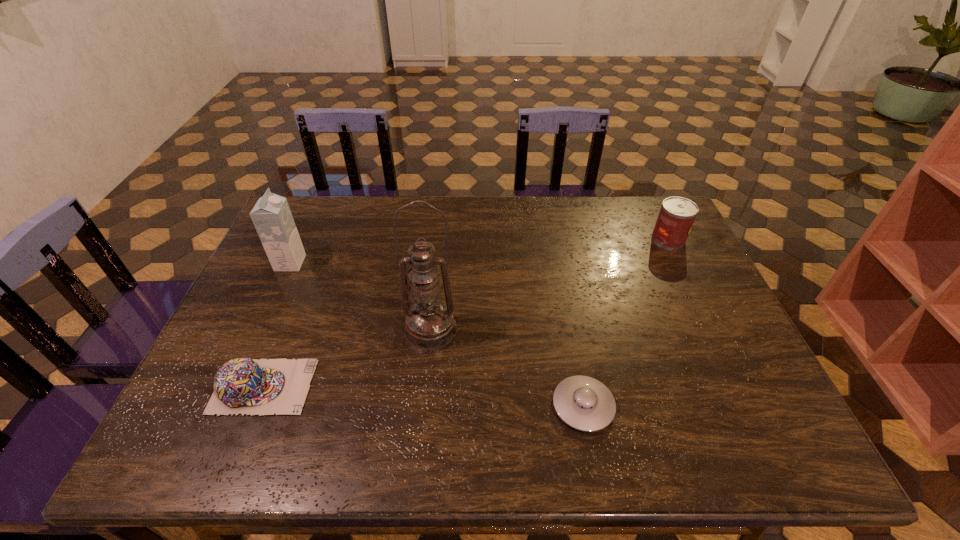
At what (x,y) coordinates should I click in order to perform the action: click on empty location between the fourth tallest object and the second object from right to left. Please return your answer as a coordinate pair (x, y). This screenshot has width=960, height=540. Looking at the image, I should click on (423, 396).

The height and width of the screenshot is (540, 960). I want to click on vacant region between the fourth nearest object and the third object from right to left, so click(x=361, y=296).

At what (x,y) coordinates should I click in order to perform the action: click on vacant space in between the can and the oil lamp. Please return your answer as a coordinate pair (x, y). Looking at the image, I should click on pos(550,284).

Where is `unoccupied position between the oil lamp and the second object from right to left`? unoccupied position between the oil lamp and the second object from right to left is located at coordinates (507, 367).

Locate an element on the screen. the third closest object to the third farthest object is located at coordinates (271, 215).

Find the location of `the closest object to the can`. the closest object to the can is located at coordinates (584, 403).

Identify the location of vacant space that satisfies the following two spatial constraints: 1. on the front label of the third farthest object; 2. on the right side of the carton. (260, 329).

Locate an element on the screen. free space that satisfies the following two spatial constraints: 1. on the front label of the fourth nearest object; 2. on the back side of the shortest object is located at coordinates (225, 406).

At what (x,y) coordinates should I click in order to perform the action: click on free space that satisfies the following two spatial constraints: 1. on the back side of the fourth object from left to right; 2. on the front label of the second tallest object. Please return your answer as a coordinate pair (x, y). Looking at the image, I should click on (557, 263).

Identify the location of free space that satisfies the following two spatial constraints: 1. on the front, side, and top of the shortest object; 2. on the left side of the cap. (255, 406).